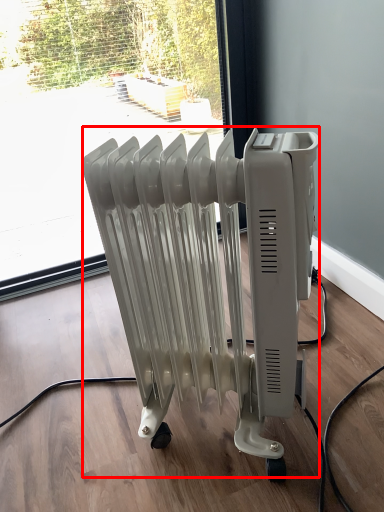
Question: From the image, what is the correct spatial relationship of bath heater (annotated by the red box) in relation to window?

Choices:
 (A) right
 (B) left

Answer: (A)